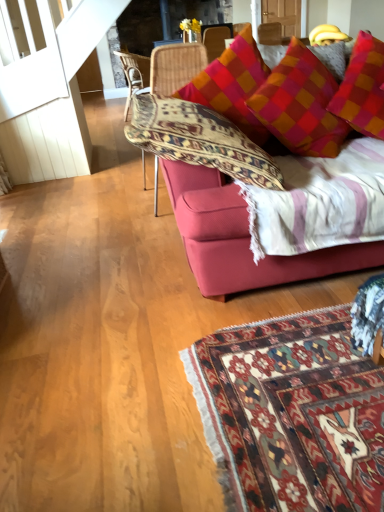
What is the approximate height of woven rattan chair at center, the 2th chair ordered from the bottom?

woven rattan chair at center, the 2th chair ordered from the bottom, is 31.01 inches tall.

Locate an element on the screen. woven rattan chair at center, marked as the 1th chair in a left-to-right arrangement is located at coordinates (134, 74).

This screenshot has height=512, width=384. I want to click on woven wicker chair at center, which is counted as the 2th chair, starting from the left, so click(x=175, y=66).

From a real-world perspective, is woven rattan chair at center, marked as the 1th chair in a left-to-right arrangement, positioned above or below velvet red couch at upper right?

woven rattan chair at center, marked as the 1th chair in a left-to-right arrangement, is situated higher than velvet red couch at upper right in the real world.

Which is more to the right, woven rattan chair at center, the first chair when ordered from back to front, or velvet red couch at upper right?

From the viewer's perspective, velvet red couch at upper right appears more on the right side.

Which of these two, woven rattan chair at center, the 2th chair ordered from the bottom, or velvet red couch at upper right, is thinner?

Thinner between the two is woven rattan chair at center, the 2th chair ordered from the bottom.

In the scene shown: Would you say woven rattan chair at center, marked as the 1th chair in a left-to-right arrangement, contains velvet red couch at upper right?

Definitely not — velvet red couch at upper right is not inside woven rattan chair at center, marked as the 1th chair in a left-to-right arrangement.

Is woven wicker chair at center, which is counted as the 2th chair, starting from the left, positioned in front of velvet red couch at upper right?

No, the depth of woven wicker chair at center, which is counted as the 2th chair, starting from the left, is greater than that of velvet red couch at upper right.

Between woven wicker chair at center, which is counted as the 2th chair, starting from the left, and velvet red couch at upper right, which one has smaller size?

woven wicker chair at center, which is counted as the 2th chair, starting from the left.

In the image, is woven wicker chair at center, the first chair in the bottom-to-top sequence, on the left side or the right side of velvet red couch at upper right?

Result: woven wicker chair at center, the first chair in the bottom-to-top sequence, is to the left of velvet red couch at upper right.

Is velvet red couch at upper right oriented towards woven rattan chair at center, the 2th chair ordered from the bottom?

No, velvet red couch at upper right is not aimed at woven rattan chair at center, the 2th chair ordered from the bottom.

Does point (178, 54) appear closer or farther from the camera than point (135, 69)?

Clearly, point (178, 54) is closer to the camera than point (135, 69).

Is velvet red couch at upper right next to woven rattan chair at center, the 2th chair viewed from the front, and touching it?

No, velvet red couch at upper right is not next to woven rattan chair at center, the 2th chair viewed from the front.

Is the position of velvet red couch at upper right more distant than that of woven rattan chair at center, the first chair when ordered from back to front?

No, it is not.

Is woven wicker chair at center, the first chair positioned from the front, facing away from woven rattan chair at center, the 2th chair in the right-to-left sequence?

No, woven wicker chair at center, the first chair positioned from the front, is not facing away from woven rattan chair at center, the 2th chair in the right-to-left sequence.

From a real-world perspective, which object rests below the other?

woven rattan chair at center, the 2th chair viewed from the front, from a real-world perspective.

Does woven wicker chair at center, which is counted as the 1th chair, starting from the right, lie behind woven rattan chair at center, acting as the 1th chair starting from the top?

No, woven wicker chair at center, which is counted as the 1th chair, starting from the right, is closer to the camera.

From the image's perspective, which is above, woven wicker chair at center, which appears as the 2th chair when viewed from the top, or woven rattan chair at center, the 2th chair ordered from the bottom?

From the image's view, woven rattan chair at center, the 2th chair ordered from the bottom, is above.

Which is correct: woven rattan chair at center, the first chair when ordered from back to front, is inside woven wicker chair at center, which is counted as the 1th chair, starting from the right, or outside of it?

woven rattan chair at center, the first chair when ordered from back to front, is not enclosed by woven wicker chair at center, which is counted as the 1th chair, starting from the right.

Does woven rattan chair at center, the first chair when ordered from back to front, have a greater height compared to woven wicker chair at center, which appears as the 2th chair when viewed from the back?

No.

Which point is more forward, (131, 92) or (179, 82)?

The point (179, 82) is in front.

Is woven rattan chair at center, acting as the 1th chair starting from the top, oriented away from woven wicker chair at center, which is counted as the 2th chair, starting from the left?

No, woven rattan chair at center, acting as the 1th chair starting from the top,'s orientation is not away from woven wicker chair at center, which is counted as the 2th chair, starting from the left.

Is velvet red couch at upper right aimed at woven wicker chair at center, the first chair in the bottom-to-top sequence?

No, velvet red couch at upper right is not facing towards woven wicker chair at center, the first chair in the bottom-to-top sequence.

Consider the image. Is velvet red couch at upper right far from woven wicker chair at center, which is counted as the 2th chair, starting from the left?

They are positioned close to each other.

Does velvet red couch at upper right come behind woven wicker chair at center, the first chair positioned from the front?

No, velvet red couch at upper right is in front of woven wicker chair at center, the first chair positioned from the front.

Can you confirm if velvet red couch at upper right is positioned to the right of woven wicker chair at center, which appears as the 2th chair when viewed from the back?

Yes, velvet red couch at upper right is to the right of woven wicker chair at center, which appears as the 2th chair when viewed from the back.

From the velvet red couch at upper right, count the 2nd chair to the left and point to it. Please provide its 2D coordinates.

[(134, 74)]

Image resolution: width=384 pixels, height=512 pixels. There is a velvet red couch at upper right. Identify the location of the 2nd chair above it (from a real-world perspective). (175, 66).

Estimate the real-world distances between objects in this image. Which object is closer to velvet red couch at upper right, woven wicker chair at center, the first chair in the bottom-to-top sequence, or woven rattan chair at center, the 2th chair viewed from the front?

The object closer to velvet red couch at upper right is woven wicker chair at center, the first chair in the bottom-to-top sequence.

When comparing their distances from velvet red couch at upper right, does woven rattan chair at center, acting as the 1th chair starting from the top, or woven wicker chair at center, which is counted as the 2th chair, starting from the left, seem closer?

Among the two, woven wicker chair at center, which is counted as the 2th chair, starting from the left, is located nearer to velvet red couch at upper right.

Considering their positions, is velvet red couch at upper right positioned further to woven rattan chair at center, the 2th chair ordered from the bottom, than woven wicker chair at center, the first chair in the bottom-to-top sequence?

velvet red couch at upper right is positioned further to the anchor woven rattan chair at center, the 2th chair ordered from the bottom.

Estimate the real-world distances between objects in this image. Which object is further from woven wicker chair at center, the first chair positioned from the front, velvet red couch at upper right or woven rattan chair at center, acting as the 1th chair starting from the top?

Among the two, woven rattan chair at center, acting as the 1th chair starting from the top, is located further to woven wicker chair at center, the first chair positioned from the front.

When comparing their distances from woven rattan chair at center, the first chair when ordered from back to front, does woven wicker chair at center, which is counted as the 2th chair, starting from the left, or velvet red couch at upper right seem further?

velvet red couch at upper right lies further to woven rattan chair at center, the first chair when ordered from back to front, than the other object.

Looking at the image, which one is located further to woven wicker chair at center, the first chair positioned from the front, woven rattan chair at center, the 2th chair in the right-to-left sequence, or velvet red couch at upper right?

woven rattan chair at center, the 2th chair in the right-to-left sequence, lies further to woven wicker chair at center, the first chair positioned from the front, than the other object.

Image resolution: width=384 pixels, height=512 pixels. In order to click on chair positioned between velvet red couch at upper right and woven rattan chair at center, the 2th chair viewed from the front, from near to far in this screenshot , I will do `click(175, 66)`.